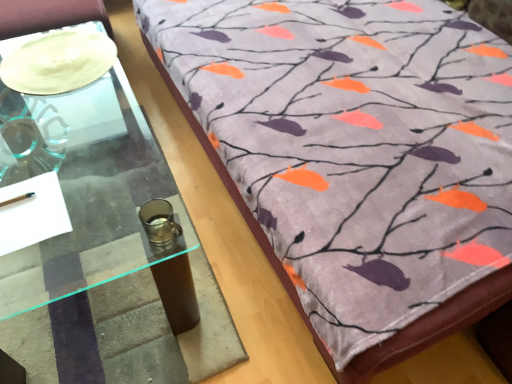
Question: Could you tell me if white matte plate at upper left is facing clear glass table at left?

Choices:
 (A) yes
 (B) no

Answer: (B)

Question: Are white matte plate at upper left and clear glass table at left beside each other?

Choices:
 (A) no
 (B) yes

Answer: (A)

Question: Is white matte plate at upper left behind clear glass table at left?

Choices:
 (A) no
 (B) yes

Answer: (B)

Question: Would you say white matte plate at upper left is a long distance from clear glass table at left?

Choices:
 (A) no
 (B) yes

Answer: (A)

Question: From the image's perspective, is white matte plate at upper left under clear glass table at left?

Choices:
 (A) no
 (B) yes

Answer: (A)

Question: Based on their sizes in the image, would you say white matte plate at upper left is bigger or smaller than clear glass table at left?

Choices:
 (A) small
 (B) big

Answer: (A)

Question: Considering their positions, is white matte plate at upper left located in front of or behind clear glass table at left?

Choices:
 (A) behind
 (B) front

Answer: (A)

Question: Is point (47, 61) closer or farther from the camera than point (11, 89)?

Choices:
 (A) farther
 (B) closer

Answer: (B)

Question: In the image, is white matte plate at upper left on the left side or the right side of clear glass table at left?

Choices:
 (A) right
 (B) left

Answer: (B)

Question: Considering the positions of point (101, 370) and point (267, 23), is point (101, 370) closer or farther from the camera than point (267, 23)?

Choices:
 (A) farther
 (B) closer

Answer: (B)

Question: From a real-world perspective, relative to velvet fabric bedspread at upper right, is clear glass table at left vertically above or below?

Choices:
 (A) above
 (B) below

Answer: (A)

Question: In the image, is clear glass table at left on the left side or the right side of velvet fabric bedspread at upper right?

Choices:
 (A) right
 (B) left

Answer: (B)

Question: From the image's perspective, is clear glass table at left located above or below velvet fabric bedspread at upper right?

Choices:
 (A) below
 (B) above

Answer: (A)

Question: Visually, is clear glass table at left positioned to the left or to the right of white matte plate at upper left?

Choices:
 (A) left
 (B) right

Answer: (B)

Question: In the image, is clear glass table at left positioned in front of or behind white matte plate at upper left?

Choices:
 (A) behind
 (B) front

Answer: (B)